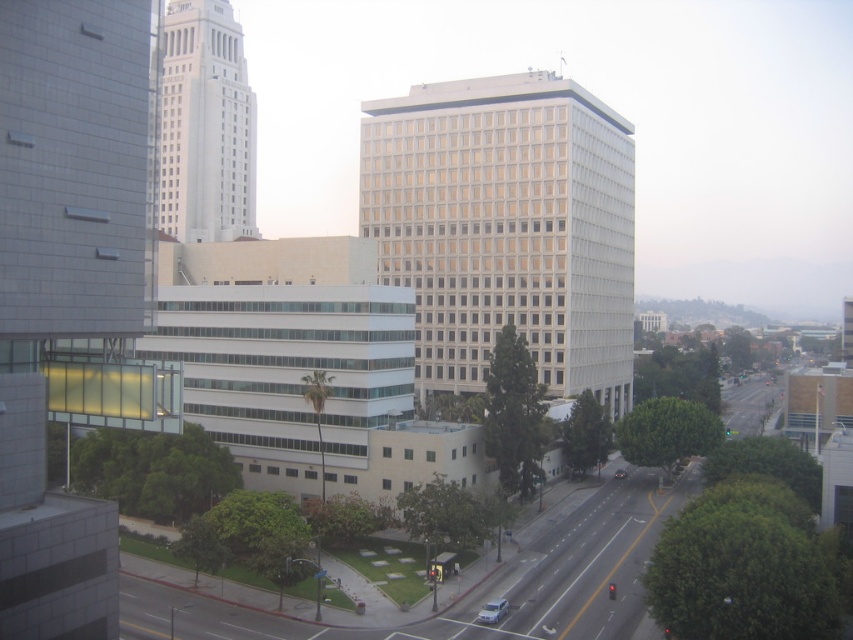
Question: Is white matte car at lower center positioned in front of shiny black sedan at center?

Choices:
 (A) yes
 (B) no

Answer: (A)

Question: Is white matte car at lower center wider than shiny black sedan at center?

Choices:
 (A) no
 (B) yes

Answer: (A)

Question: Does white matte car at lower center come behind shiny black sedan at center?

Choices:
 (A) yes
 (B) no

Answer: (B)

Question: Which of the following is the farthest from the observer?

Choices:
 (A) (619, 477)
 (B) (496, 611)

Answer: (A)